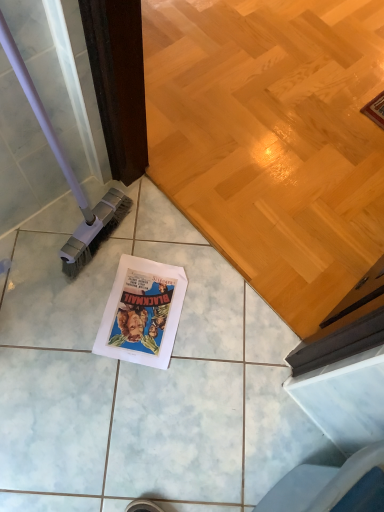
In order to click on vacant area situated to the left side of white paper comic book at center in this screenshot , I will do `click(69, 301)`.